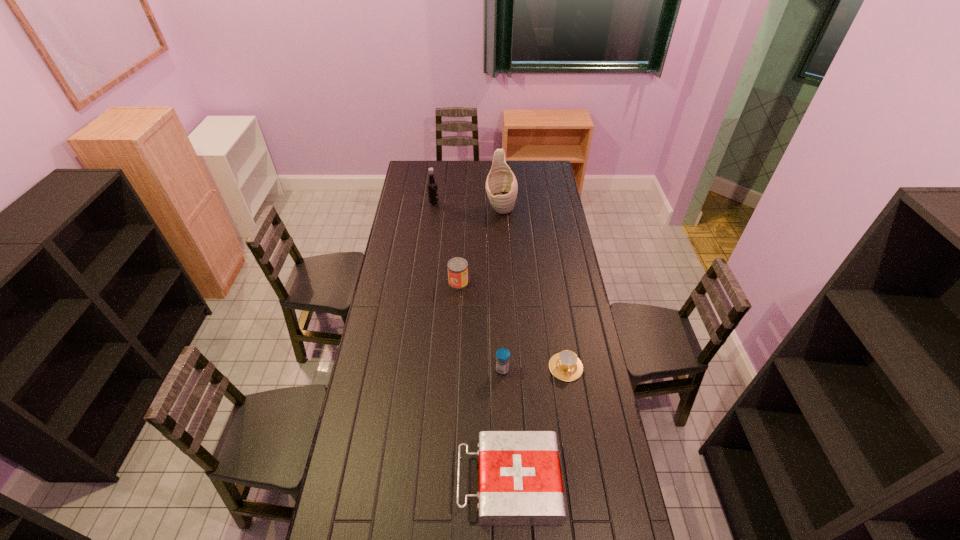
Identify the location of vacant space located on the label of the leftmost object. This screenshot has width=960, height=540. tap(494, 203).

The width and height of the screenshot is (960, 540). Identify the location of free region located 0.150m on the back of the third farthest object. (460, 254).

At what (x,y) coordinates should I click in order to perform the action: click on vacant space situated on the right of the medicine. Please return your answer as a coordinate pair (x, y). Looking at the image, I should click on (572, 370).

This screenshot has width=960, height=540. I want to click on vacant space located on the front side of the second shortest object, so click(443, 482).

This screenshot has height=540, width=960. Find the location of `free space located 0.300m on the front side of the second shortest object`. free space located 0.300m on the front side of the second shortest object is located at coordinates (367, 482).

Image resolution: width=960 pixels, height=540 pixels. I want to click on vacant area situated on the front side of the second shortest object, so click(424, 482).

Find the location of a particular element. This screenshot has width=960, height=540. free point located with the handle on the side of the rightmost object is located at coordinates pos(586,490).

Locate an element on the screen. The width and height of the screenshot is (960, 540). object positioned at the right edge is located at coordinates (566, 366).

At what (x,y) coordinates should I click in order to perform the action: click on free location at the left edge of the desktop. Please return your answer as a coordinate pair (x, y). This screenshot has height=540, width=960. Looking at the image, I should click on (398, 265).

The height and width of the screenshot is (540, 960). In the image, there is a desktop. In order to click on free space at the right edge in this screenshot , I will do `click(566, 424)`.